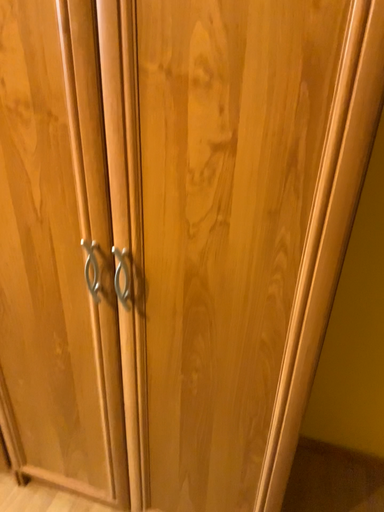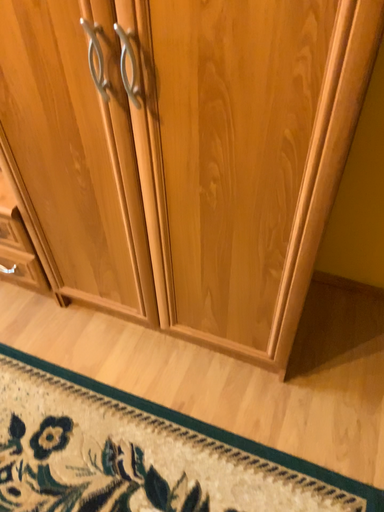
Question: How did the camera likely rotate when shooting the video?

Choices:
 (A) rotated upward
 (B) rotated downward

Answer: (B)